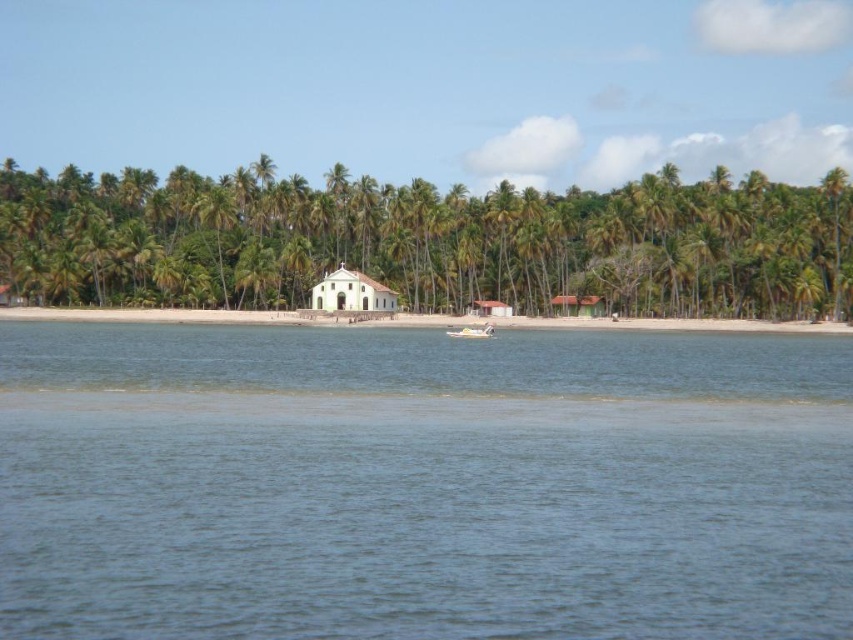
Question: Considering the real-world distances, which object is closest to the green leafy palm tree at center?

Choices:
 (A) brown wooden hut at center
 (B) clear blue water at center

Answer: (A)

Question: Is green leafy palm tree at center above white sand beach at center?

Choices:
 (A) no
 (B) yes

Answer: (B)

Question: Can you confirm if green leafy palm tree at center is positioned to the left of white plastic boat at center?

Choices:
 (A) yes
 (B) no

Answer: (A)

Question: Does green leafy palm tree at center have a greater width compared to white sand beach at center?

Choices:
 (A) yes
 (B) no

Answer: (A)

Question: Which point appears closest to the camera in this image?

Choices:
 (A) (567, 196)
 (B) (662, 328)
 (C) (376, 304)
 (D) (340, 436)

Answer: (D)

Question: Which of the following is the closest to the observer?

Choices:
 (A) white wooden hut at center
 (B) white sand beach at center
 (C) clear blue water at center
 (D) brown wooden hut at center

Answer: (C)